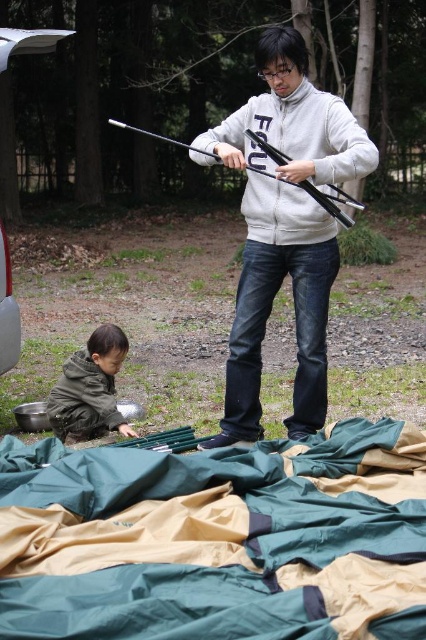
From the picture: What is the spatial relationship between the green fabric blanket at lower center and the point at coordinates [216,538]?

The green fabric blanket at lower center is represented by the point at coordinates [216,538].

You are a drone operator trying to deliver a package to the white matte jacket at center. There is a point at coordinates point (x=284, y=228). Is this point on the white matte jacket at center?

Yes, the point (x=284, y=228) is on the white matte jacket at center, so the package can be delivered there.

You are a photographer trying to capture a wide shot of the scene. You need to ensure both the white matte jacket at center and the metallic silver minivan at lower left are fully visible in the frame. Given their widths, which object will require you to adjust your camera angle more to include it in the shot?

The white matte jacket at center has a greater width than the metallic silver minivan at lower left, so it will require more adjustment to the camera angle to ensure it fits within the frame.